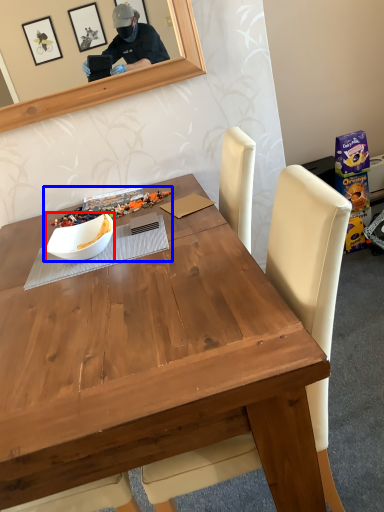
Question: Among these objects, which one is nearest to the camera, bowl (highlighted by a red box) or fruit dish (highlighted by a blue box)?

Choices:
 (A) bowl
 (B) fruit dish

Answer: (A)